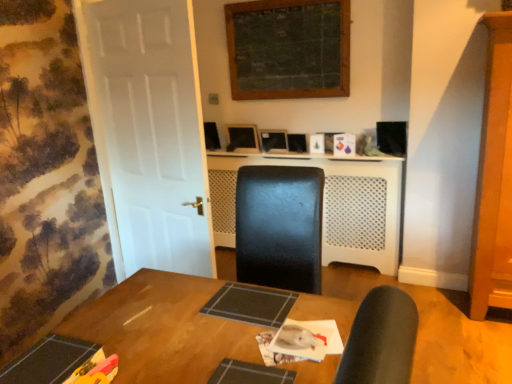
The width and height of the screenshot is (512, 384). What are the coordinates of `free spot in front of matte black monitor at center` in the screenshot? It's located at (250, 149).